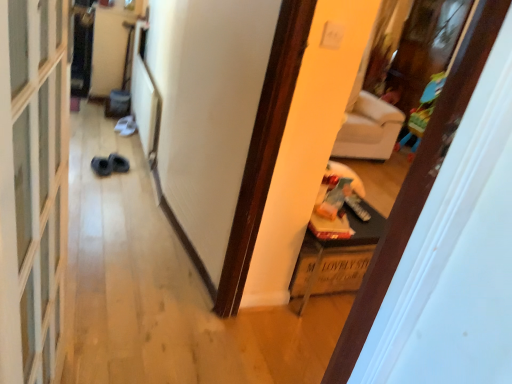
Question: Is wooden crate at lower right closer to the viewer compared to plastic colorful playpen at upper right?

Choices:
 (A) no
 (B) yes

Answer: (B)

Question: From the image's perspective, does wooden crate at lower right appear lower than plastic colorful playpen at upper right?

Choices:
 (A) no
 (B) yes

Answer: (B)

Question: Is wooden crate at lower right looking in the opposite direction of plastic colorful playpen at upper right?

Choices:
 (A) yes
 (B) no

Answer: (B)

Question: Is wooden crate at lower right bigger than plastic colorful playpen at upper right?

Choices:
 (A) yes
 (B) no

Answer: (B)

Question: Is wooden crate at lower right thinner than plastic colorful playpen at upper right?

Choices:
 (A) yes
 (B) no

Answer: (B)

Question: Is point (x=302, y=246) positioned closer to the camera than point (x=412, y=148)?

Choices:
 (A) farther
 (B) closer

Answer: (B)

Question: Visually, is wooden crate at lower right positioned to the left or to the right of plastic colorful playpen at upper right?

Choices:
 (A) right
 (B) left

Answer: (B)

Question: Is wooden crate at lower right situated inside plastic colorful playpen at upper right or outside?

Choices:
 (A) inside
 (B) outside

Answer: (B)

Question: Relative to plastic colorful playpen at upper right, is wooden crate at lower right in front or behind?

Choices:
 (A) behind
 (B) front

Answer: (B)

Question: In terms of size, does transparent glass screen door at left appear bigger or smaller than plastic colorful playpen at upper right?

Choices:
 (A) small
 (B) big

Answer: (A)

Question: From the image's perspective, is transparent glass screen door at left above or below plastic colorful playpen at upper right?

Choices:
 (A) above
 (B) below

Answer: (B)

Question: Is transparent glass screen door at left inside the boundaries of plastic colorful playpen at upper right, or outside?

Choices:
 (A) inside
 (B) outside

Answer: (B)

Question: From their relative heights in the image, would you say transparent glass screen door at left is taller or shorter than plastic colorful playpen at upper right?

Choices:
 (A) tall
 (B) short

Answer: (A)

Question: Is black suede shoes at lower left wider or thinner than wooden crate at lower right?

Choices:
 (A) thin
 (B) wide

Answer: (A)

Question: In the image, is black suede shoes at lower left on the left side or the right side of wooden crate at lower right?

Choices:
 (A) left
 (B) right

Answer: (A)